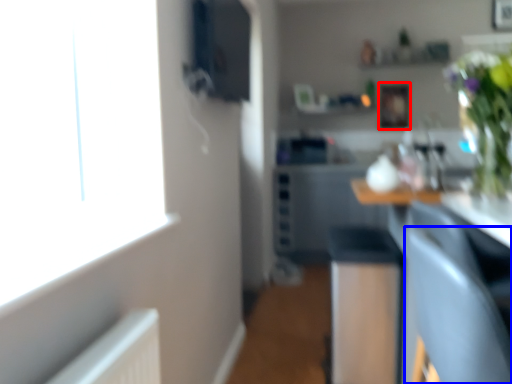
Question: Among these objects, which one is nearest to the camera, picture frame (highlighted by a red box) or armchair (highlighted by a blue box)?

Choices:
 (A) picture frame
 (B) armchair

Answer: (B)